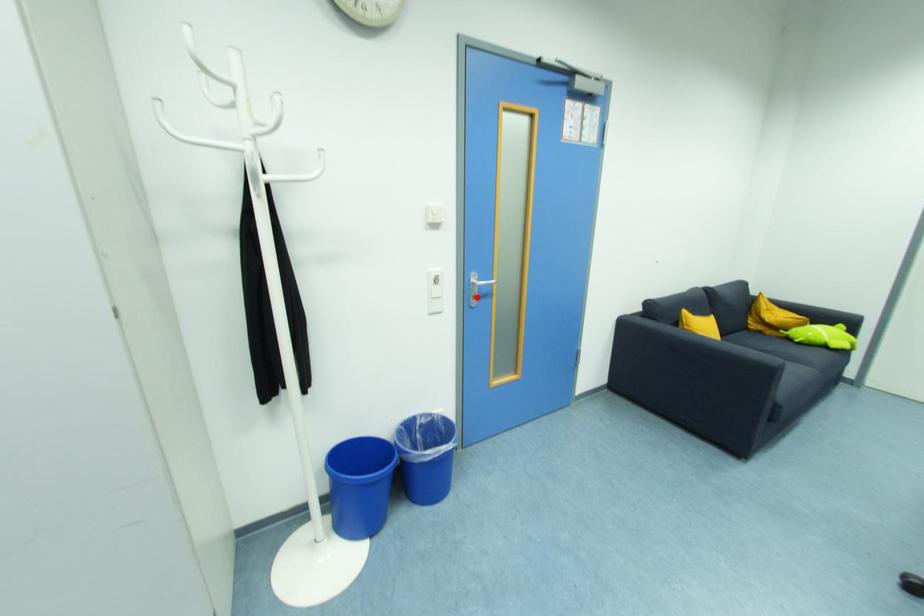
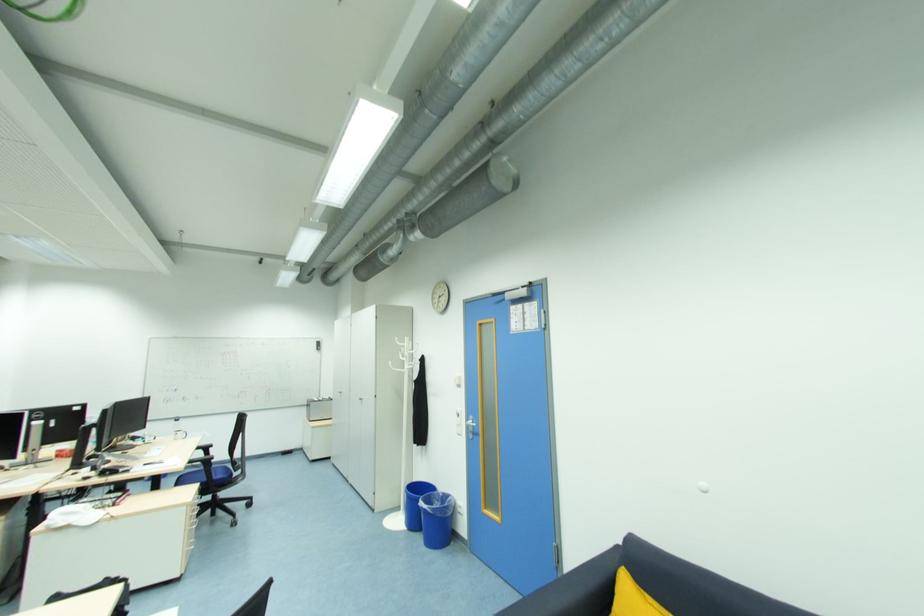
Question: I am providing you with two images of the same scene from different viewpoints. A red point is shown in image1. For the corresponding object point in image2, is it positioned nearer or farther from the camera?

Choices:
 (A) Nearer
 (B) Farther

Answer: (B)